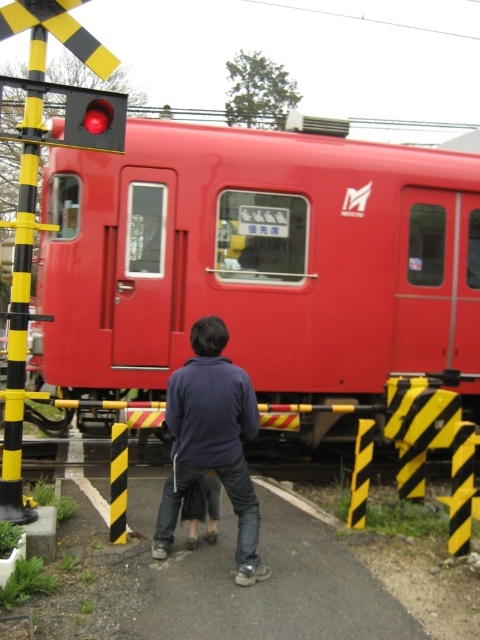
You are a fashion designer looking at the scene. You see the dark blue fleece at center and the matte red button at upper left. Which one is bigger?

The dark blue fleece at center is larger in size compared to the matte red button at upper left.